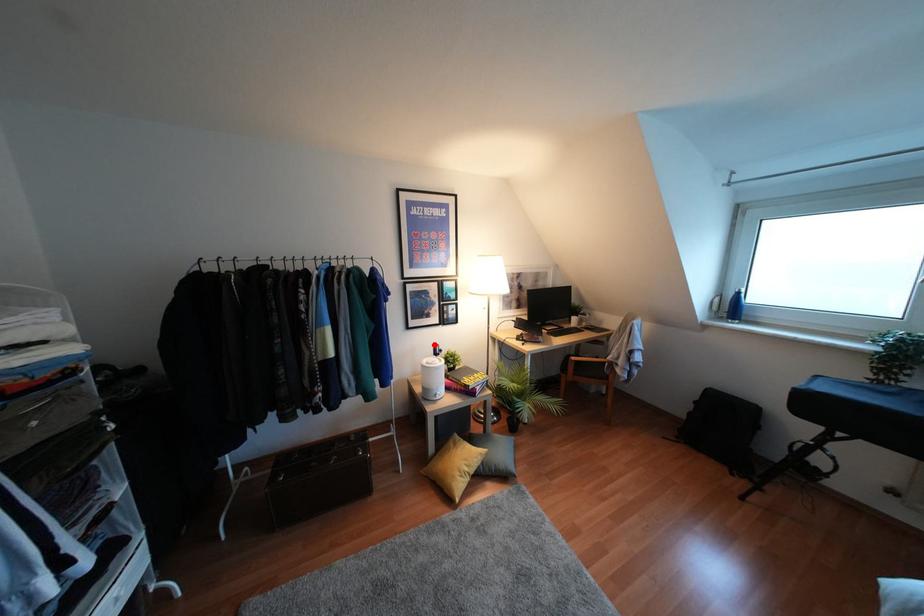
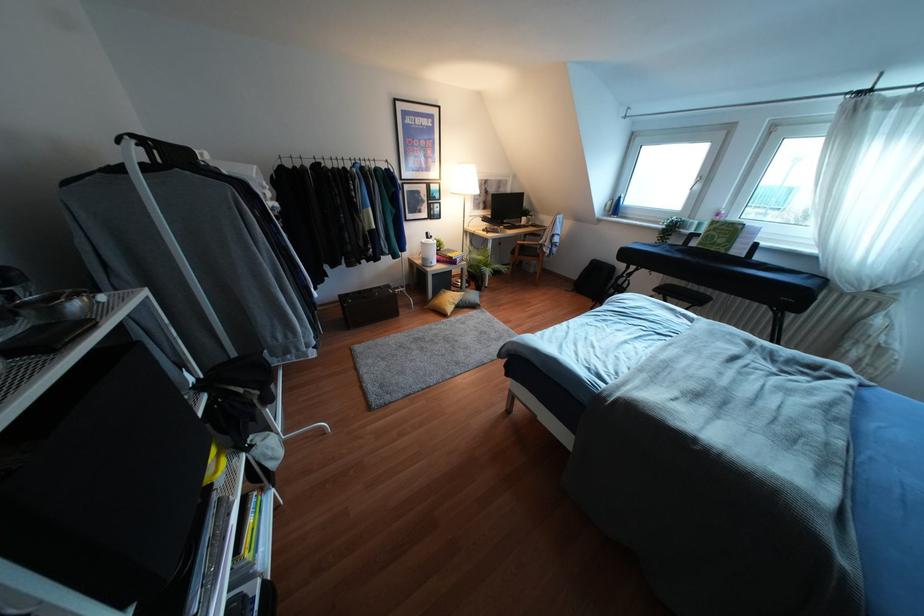
Find the pixel in the second image that matches the highlighted location in the first image.

(427, 233)